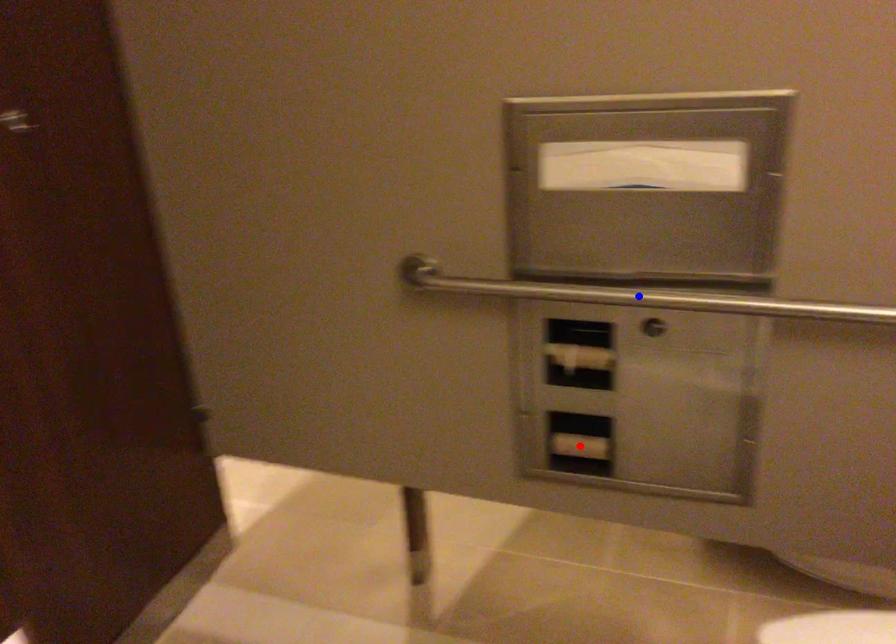
Question: Which of the two points in the image is closer to the camera?

Choices:
 (A) Blue point is closer.
 (B) Red point is closer.

Answer: (A)